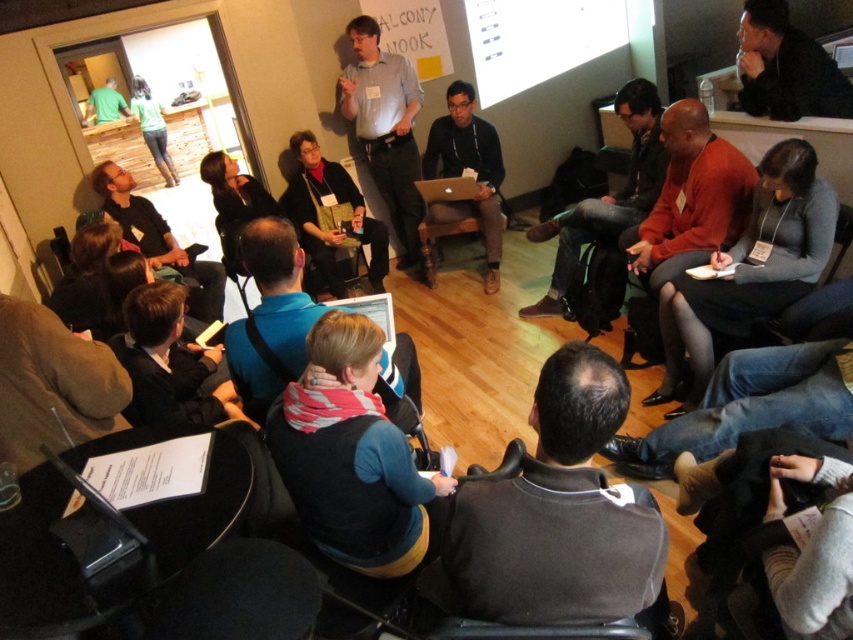
You are organizing a photo shoot for a promotional video. The camera is positioned at the back of the room, and you need to ensure both the light blue shirt at center and the matte black laptop at center are clearly visible. Considering their sizes, which object should be placed closer to the camera to ensure both are equally visible in the frame?

The matte black laptop at center should be placed closer to the camera since it is smaller in size than the light blue shirt at center. This adjustment will help balance their visibility in the frame.